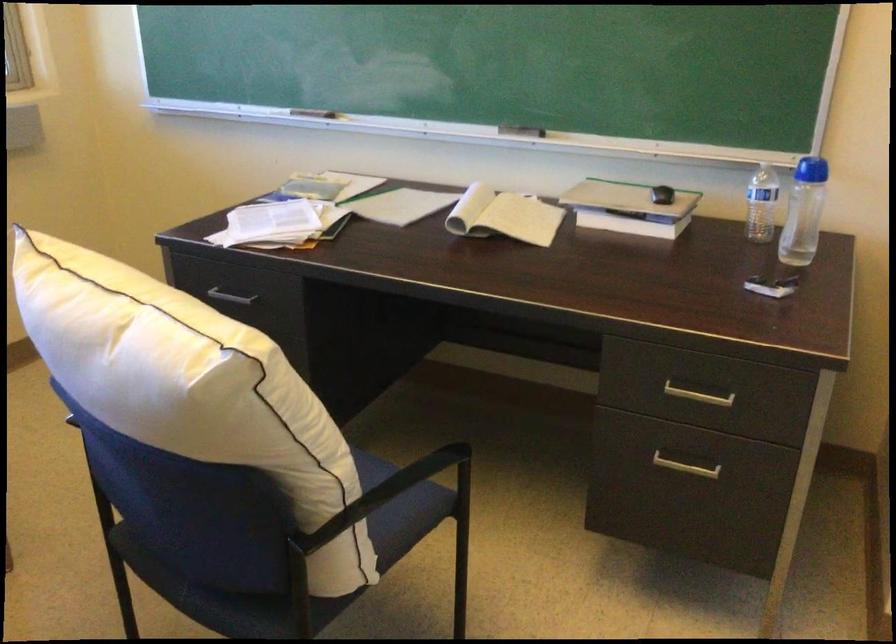
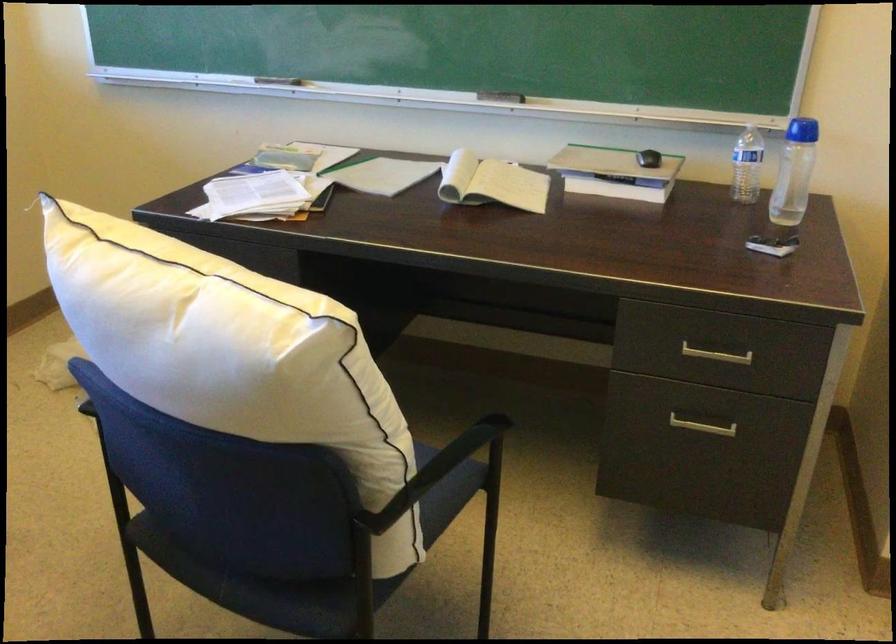
Question: Based on the continuous images, in which direction is the camera rotating? Reply with the corresponding letter.

Choices:
 (A) Left
 (B) Right
 (C) Up
 (D) Down

Answer: (B)